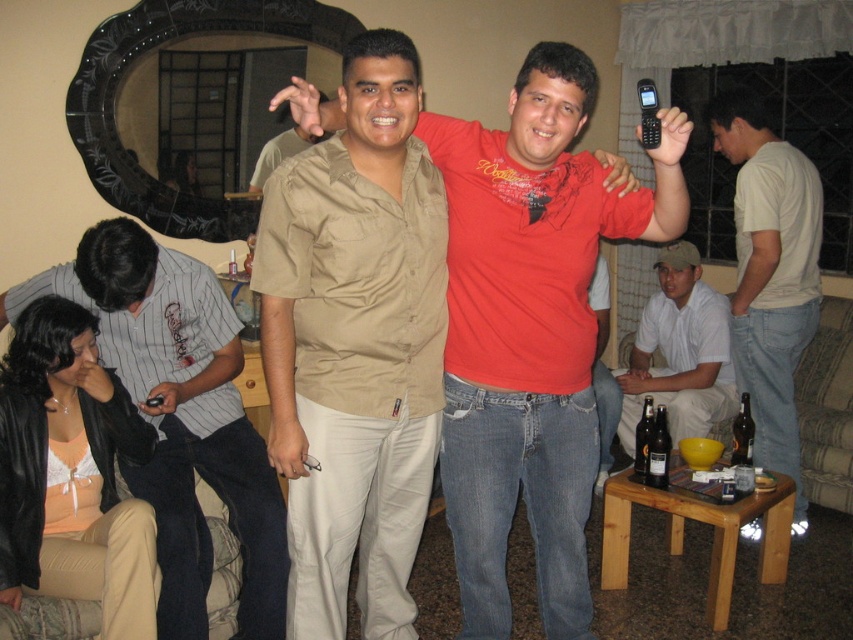
You are at a party and want to find the striped cotton shirt at lower left. Which direction should you look to find the point at [180,417]?

The point at [180,417] is located on the striped cotton shirt at lower left, so you should look towards the lower left direction to find it.

You are a photographer at the event and want to ensure both the striped cotton shirt at lower left and the white cotton shirt at lower right are clearly visible in your photo. Which shirt should you focus on first to ensure both are in focus?

The striped cotton shirt at lower left is in front of the white cotton shirt at lower right, so focusing on the striped cotton shirt at lower left first will help ensure both are in focus since it is closer to the camera.

You are at the party and want to move from the location of point (167, 579) to point (695, 412). Is the path between them clear?

Yes, the path between point (167, 579) and point (695, 412) is clear because point (167, 579) is in front of point (695, 412), indicating they are along the same line of sight without obstructions.